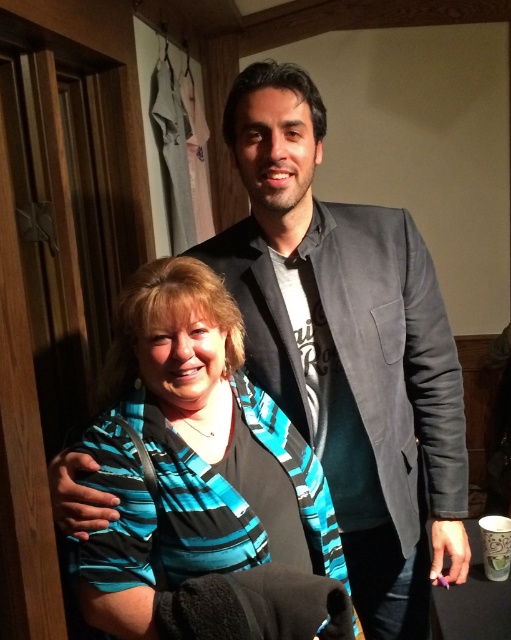
Is gray fabric suit at upper center below teal striped shirt at center?

No, gray fabric suit at upper center is not below teal striped shirt at center.

Does gray fabric suit at upper center lie in front of teal striped shirt at center?

No, gray fabric suit at upper center is further to the viewer.

What do you see at coordinates (347, 348) in the screenshot? This screenshot has width=511, height=640. I see `gray fabric suit at upper center` at bounding box center [347, 348].

Find the location of a particular element. This screenshot has height=640, width=511. gray fabric suit at upper center is located at coordinates (347, 348).